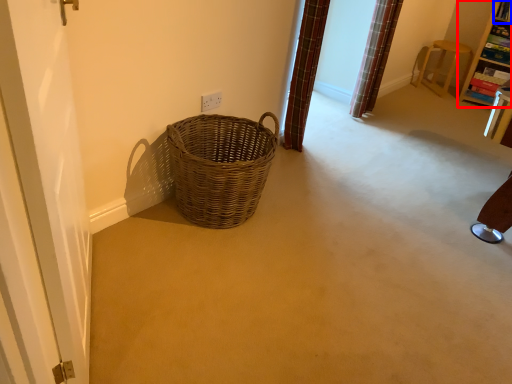
Question: Which of the following is the farthest to the observer, furniture (highlighted by a red box) or shelf (highlighted by a blue box)?

Choices:
 (A) furniture
 (B) shelf

Answer: (B)